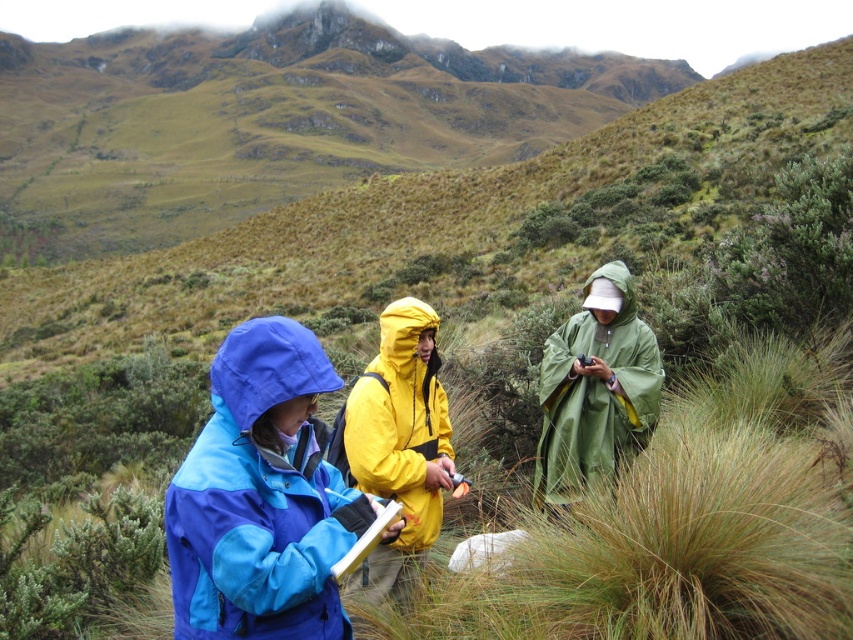
Who is positioned more to the left, brown dry grass at center or yellow matte jacket at center?

Positioned to the left is yellow matte jacket at center.

Looking at this image, is brown dry grass at center smaller than yellow matte jacket at center?

No.

Image resolution: width=853 pixels, height=640 pixels. What do you see at coordinates (685, 520) in the screenshot?
I see `brown dry grass at center` at bounding box center [685, 520].

Where is `brown dry grass at center`? This screenshot has width=853, height=640. brown dry grass at center is located at coordinates (685, 520).

Is brown dry grass at center wider than green waterproof poncho at center?

Yes, brown dry grass at center is wider than green waterproof poncho at center.

Where is `brown dry grass at center`? The height and width of the screenshot is (640, 853). brown dry grass at center is located at coordinates (685, 520).

This screenshot has width=853, height=640. What are the coordinates of `brown dry grass at center` in the screenshot? It's located at (685, 520).

Is brown grassy hillside at upper center wider than green waterproof poncho at center?

Indeed, brown grassy hillside at upper center has a greater width compared to green waterproof poncho at center.

Is brown grassy hillside at upper center shorter than green waterproof poncho at center?

No.

Is point (361, 118) positioned after point (556, 381)?

Yes, it is.

Identify the location of brown grassy hillside at upper center. Image resolution: width=853 pixels, height=640 pixels. (268, 120).